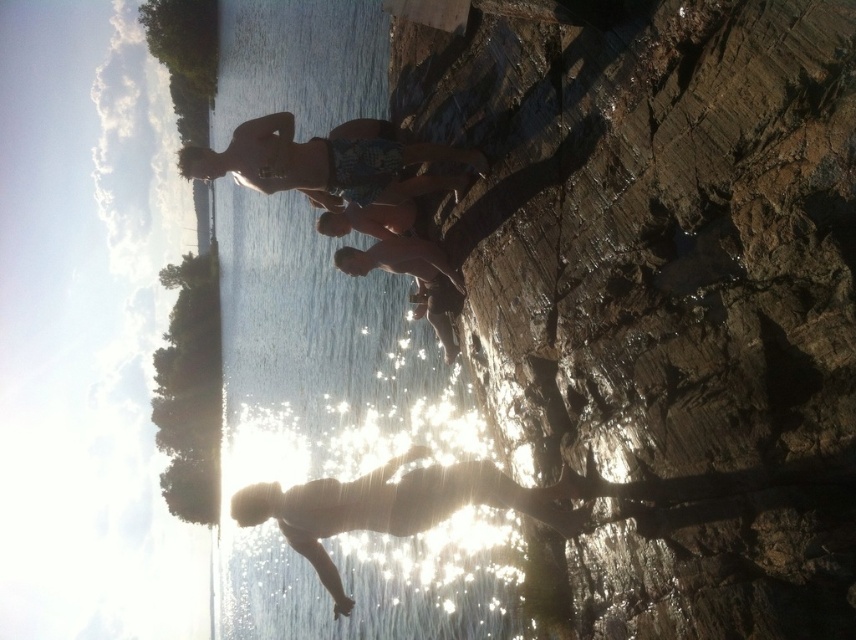
In the scene shown: Is clear water at center positioned behind patterned swim trunks at center?

Yes, clear water at center is behind patterned swim trunks at center.

Who is positioned more to the left, clear water at center or patterned swim trunks at center?

From the viewer's perspective, clear water at center appears more on the left side.

The image size is (856, 640). What are the coordinates of `clear water at center` in the screenshot? It's located at (340, 436).

The width and height of the screenshot is (856, 640). What do you see at coordinates (666, 296) in the screenshot? I see `brown rough rock at center` at bounding box center [666, 296].

Is brown rough rock at center further to camera compared to clear water at center?

No.

You are a GUI agent. You are given a task and a screenshot of the screen. Output one action in this format:
    pyautogui.click(x=<x>, y=<y>)
    Task: Click on the brown rough rock at center
    The height and width of the screenshot is (640, 856).
    Given the screenshot: What is the action you would take?
    pyautogui.click(x=666, y=296)

Does point (684, 241) lie in front of point (444, 492)?

Yes, point (684, 241) is closer to viewer.

Can you confirm if brown rough rock at center is smaller than silhouette skin at center?

Actually, brown rough rock at center might be larger than silhouette skin at center.

This screenshot has width=856, height=640. Find the location of `brown rough rock at center`. brown rough rock at center is located at coordinates (666, 296).